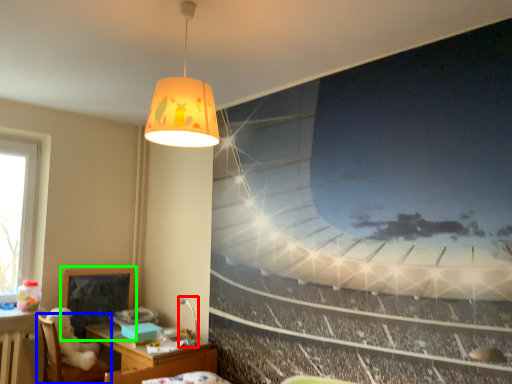
Question: Which is farther away from lamp (highlighted by a red box)? furniture (highlighted by a blue box) or bulletin board (highlighted by a green box)?

Choices:
 (A) furniture
 (B) bulletin board

Answer: (A)